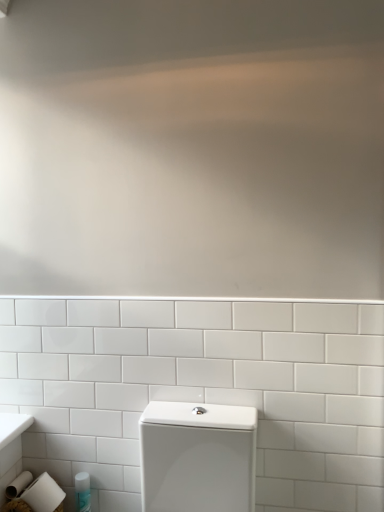
Question: From the image's perspective, is white glossy toilet at lower center positioned above or below translucent plastic bottle at lower left?

Choices:
 (A) above
 (B) below

Answer: (A)

Question: Looking at the image, does white glossy toilet at lower center seem bigger or smaller compared to translucent plastic bottle at lower left?

Choices:
 (A) small
 (B) big

Answer: (B)

Question: Would you say white glossy toilet at lower center is inside or outside translucent plastic bottle at lower left?

Choices:
 (A) inside
 (B) outside

Answer: (B)

Question: Is translucent plastic bottle at lower left wider or thinner than white glossy toilet at lower center?

Choices:
 (A) thin
 (B) wide

Answer: (A)

Question: From the image's perspective, relative to white glossy toilet at lower center, is translucent plastic bottle at lower left above or below?

Choices:
 (A) below
 (B) above

Answer: (A)

Question: From a real-world perspective, is translucent plastic bottle at lower left physically located above or below white glossy toilet at lower center?

Choices:
 (A) above
 (B) below

Answer: (B)

Question: From their relative heights in the image, would you say translucent plastic bottle at lower left is taller or shorter than white glossy toilet at lower center?

Choices:
 (A) short
 (B) tall

Answer: (A)